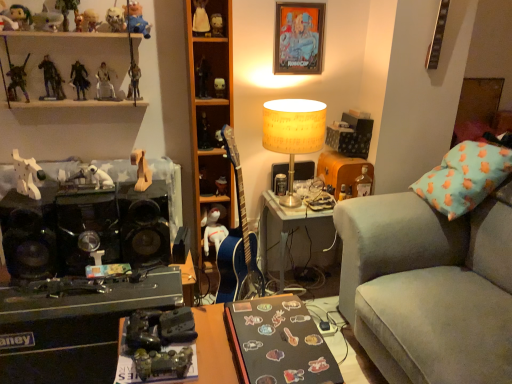
Question: Would you say wooden horse at center, marked as the 15th toy in a top-to-bottom arrangement, is a long distance from matte plastic doll at upper center, marked as the eighteenth toy in a bottom-to-top arrangement?

Choices:
 (A) yes
 (B) no

Answer: (B)

Question: Can you confirm if wooden horse at center, arranged as the 4th toy when ordered from the bottom, is taller than matte plastic doll at upper center, arranged as the 1th toy when viewed from the top?

Choices:
 (A) no
 (B) yes

Answer: (A)

Question: Is wooden horse at center, arranged as the 4th toy when ordered from the bottom, thinner than matte plastic doll at upper center, arranged as the 1th toy when viewed from the top?

Choices:
 (A) yes
 (B) no

Answer: (B)

Question: Is wooden horse at center, arranged as the 4th toy when ordered from the bottom, looking in the opposite direction of matte plastic doll at upper center, marked as the eighteenth toy in a bottom-to-top arrangement?

Choices:
 (A) yes
 (B) no

Answer: (B)

Question: From the image's perspective, is wooden horse at center, marked as the 15th toy in a top-to-bottom arrangement, beneath matte plastic doll at upper center, marked as the eighteenth toy in a bottom-to-top arrangement?

Choices:
 (A) no
 (B) yes

Answer: (B)

Question: Is wooden horse at center, arranged as the 4th toy when ordered from the bottom, positioned before matte plastic doll at upper center, marked as the eighteenth toy in a bottom-to-top arrangement?

Choices:
 (A) yes
 (B) no

Answer: (A)

Question: Is metallic gold figure at upper center, placed as the 10th toy when sorted from bottom to top, far from black matte desk at lower center, acting as the 2th desk starting from the left?

Choices:
 (A) no
 (B) yes

Answer: (B)

Question: Does metallic gold figure at upper center, placed as the 10th toy when sorted from bottom to top, have a lesser width compared to black matte desk at lower center, the 1th desk from the right?

Choices:
 (A) yes
 (B) no

Answer: (A)

Question: Is metallic gold figure at upper center, placed as the 10th toy when sorted from bottom to top, smaller than black matte desk at lower center, acting as the 2th desk starting from the left?

Choices:
 (A) no
 (B) yes

Answer: (B)

Question: Is metallic gold figure at upper center, the ninth toy in the top-to-bottom sequence, not within black matte desk at lower center, acting as the 2th desk starting from the left?

Choices:
 (A) yes
 (B) no

Answer: (A)

Question: Is metallic gold figure at upper center, placed as the 10th toy when sorted from bottom to top, taller than black matte desk at lower center, acting as the 2th desk starting from the left?

Choices:
 (A) yes
 (B) no

Answer: (A)

Question: Is metallic gold figure at upper center, the ninth toy in the top-to-bottom sequence, positioned with its back to black matte desk at lower center, the 1th desk from the right?

Choices:
 (A) no
 (B) yes

Answer: (A)

Question: Does blue fabric toy at upper left, which appears as the 3th toy when viewed from the top, have a smaller size compared to matte plastic action figure at center, arranged as the 6th toy when ordered from the bottom?

Choices:
 (A) yes
 (B) no

Answer: (B)